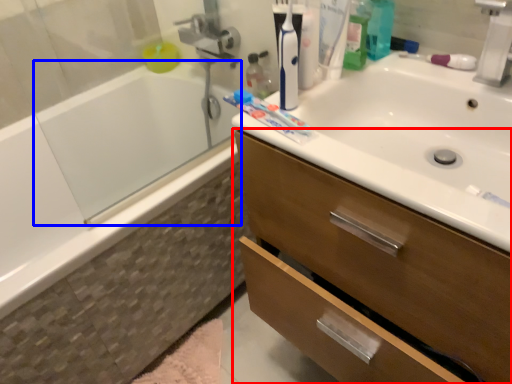
Question: Among these objects, which one is nearest to the camera, bathroom cabinet (highlighted by a red box) or bath (highlighted by a blue box)?

Choices:
 (A) bathroom cabinet
 (B) bath

Answer: (A)